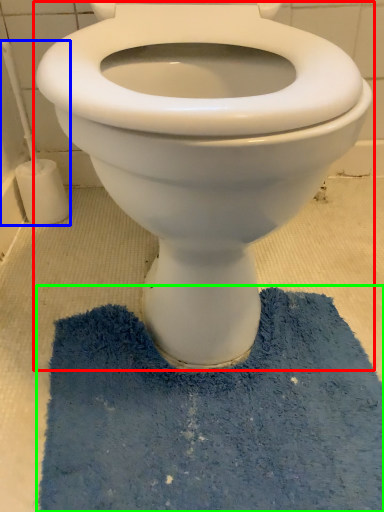
Question: Considering the real-world distances, which object is farthest from toilet (highlighted by a red box)? brush (highlighted by a blue box) or bath mat (highlighted by a green box)?

Choices:
 (A) brush
 (B) bath mat

Answer: (A)